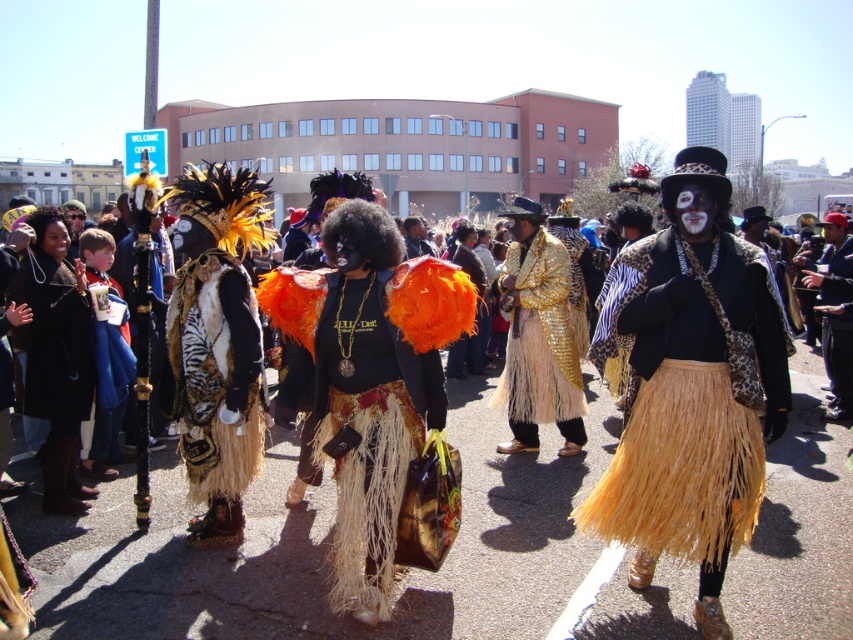
Question: Among these objects, which one is farthest from the camera?

Choices:
 (A) leopard print cape at center
 (B) tiger print fur skirt at center
 (C) leopard print jacket at center
 (D) gold sequined jacket at center

Answer: (C)

Question: Which point is farther from the camera taking this photo?

Choices:
 (A) (828, 376)
 (B) (451, 298)

Answer: (A)

Question: Based on their relative distances, which object is nearer to the gold sequined jacket at center?

Choices:
 (A) orange feathered skirt at center
 (B) leopard print jacket at center
 (C) tiger print fur skirt at center
 (D) leopard print cape at center

Answer: (D)

Question: Is tiger print fur skirt at center wider than gold sequined jacket at center?

Choices:
 (A) no
 (B) yes

Answer: (A)

Question: Can you confirm if gold sequined jacket at center is positioned below leopard print jacket at center?

Choices:
 (A) no
 (B) yes

Answer: (B)

Question: From the image, what is the correct spatial relationship of leopard print cape at center in relation to leopard print jacket at center?

Choices:
 (A) below
 (B) above

Answer: (A)